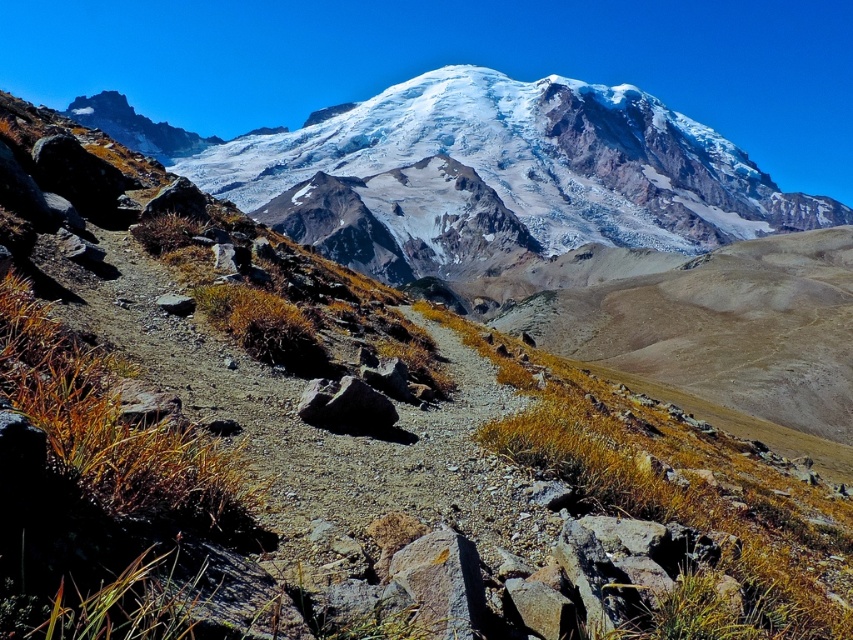
Question: Which point is closer to the camera taking this photo?

Choices:
 (A) (566, 179)
 (B) (300, 397)

Answer: (B)

Question: Is snowy granite mountain at upper center closer to camera compared to gray rough rock at center?

Choices:
 (A) yes
 (B) no

Answer: (B)

Question: Which object is closer to the camera taking this photo?

Choices:
 (A) gray rough rock at center
 (B) snowy granite mountain at upper center

Answer: (A)

Question: Which point is closer to the camera taking this photo?

Choices:
 (A) (364, 412)
 (B) (614, 195)

Answer: (A)

Question: Does snowy granite mountain at upper center appear on the left side of gray rough rock at center?

Choices:
 (A) no
 (B) yes

Answer: (A)

Question: Does snowy granite mountain at upper center have a smaller size compared to gray rough rock at center?

Choices:
 (A) no
 (B) yes

Answer: (A)